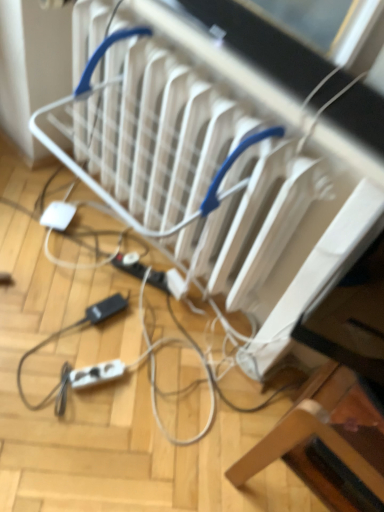
Where is `white plastic extension cord at lower left, which ranks as the 1th extension cord in bottom-to-top order`? white plastic extension cord at lower left, which ranks as the 1th extension cord in bottom-to-top order is located at coordinates (96, 374).

Image resolution: width=384 pixels, height=512 pixels. Identify the location of white plastic extension cord at lower left, which is counted as the 2th extension cord, starting from the top. (96, 374).

Between white plastic extension cord at lower left, which ranks as the 1th extension cord in bottom-to-top order, and white plastic extension cord at lower center, arranged as the 2th extension cord when viewed from the front, which one has smaller size?

With smaller size is white plastic extension cord at lower left, which ranks as the 1th extension cord in bottom-to-top order.

Looking at this image, can you confirm if white plastic extension cord at lower left, placed as the 1th extension cord when sorted from front to back, is thinner than white plastic extension cord at lower center, the 1th extension cord when ordered from top to bottom?

No.

Would you say white plastic extension cord at lower left, the second extension cord when ordered from back to front, is a long distance from white plastic extension cord at lower center, the 1th extension cord when ordered from top to bottom?

That's not correct — white plastic extension cord at lower left, the second extension cord when ordered from back to front, is a little close to white plastic extension cord at lower center, the 1th extension cord when ordered from top to bottom.

Is white plastic extension cord at lower left, which ranks as the 1th extension cord in bottom-to-top order, not within white plastic extension cord at lower center, which is counted as the second extension cord, starting from the bottom?

Yes, white plastic extension cord at lower left, which ranks as the 1th extension cord in bottom-to-top order, is located beyond the bounds of white plastic extension cord at lower center, which is counted as the second extension cord, starting from the bottom.

In the scene shown: Are white plastic extension cord at lower left, which ranks as the 1th extension cord in bottom-to-top order, and white plastic radiator at center beside each other?

No.

Is white plastic radiator at center at the back of white plastic extension cord at lower left, which ranks as the 1th extension cord in bottom-to-top order?

No, white plastic radiator at center is not at the back of white plastic extension cord at lower left, which ranks as the 1th extension cord in bottom-to-top order.

Which is in front, point (85, 373) or point (300, 232)?

The point (300, 232) is in front.

Can you confirm if white plastic extension cord at lower left, placed as the 1th extension cord when sorted from front to back, is thinner than wooden chair at lower right?

Yes.

From the image's perspective, relative to wooden chair at lower right, is white plastic extension cord at lower left, which is counted as the 2th extension cord, starting from the top, above or below?

From the image's perspective, white plastic extension cord at lower left, which is counted as the 2th extension cord, starting from the top, appears above wooden chair at lower right.

Does point (316, 390) come in front of point (140, 264)?

Yes.

Looking at this image, from a real-world perspective, is wooden chair at lower right positioned above or below white plastic extension cord at lower center, which is counted as the second extension cord, starting from the bottom?

wooden chair at lower right is situated higher than white plastic extension cord at lower center, which is counted as the second extension cord, starting from the bottom, in the real world.

Is wooden chair at lower right taller or shorter than white plastic extension cord at lower center, the first extension cord in the back-to-front sequence?

Clearly, wooden chair at lower right is taller compared to white plastic extension cord at lower center, the first extension cord in the back-to-front sequence.

Which object is wider, white plastic extension cord at lower center, the first extension cord in the back-to-front sequence, or white plastic radiator at center?

white plastic radiator at center.

Who is bigger, white plastic extension cord at lower center, the 1th extension cord when ordered from top to bottom, or white plastic radiator at center?

Bigger between the two is white plastic radiator at center.

How distant is white plastic extension cord at lower center, the first extension cord in the back-to-front sequence, from white plastic radiator at center?

white plastic extension cord at lower center, the first extension cord in the back-to-front sequence, and white plastic radiator at center are 20.42 inches apart.

Which object is further away from the camera taking this photo, white plastic extension cord at lower center, the first extension cord in the back-to-front sequence, or white plastic radiator at center?

Positioned behind is white plastic extension cord at lower center, the first extension cord in the back-to-front sequence.

Looking at the image, does white plastic radiator at center seem bigger or smaller compared to wooden chair at lower right?

Considering their sizes, white plastic radiator at center takes up more space than wooden chair at lower right.

Find the location of a particular element. The image size is (384, 512). furniture in front of the white plastic radiator at center is located at coordinates (326, 442).

Is point (343, 336) closer to camera compared to point (362, 399)?

Yes, point (343, 336) is closer to viewer.

From a real-world perspective, which is physically below, white plastic radiator at center or white plastic extension cord at lower center, the first extension cord in the back-to-front sequence?

In real-world perspective, white plastic extension cord at lower center, the first extension cord in the back-to-front sequence, is lower.

How many degrees apart are the facing directions of white plastic radiator at center and white plastic extension cord at lower center, arranged as the 2th extension cord when viewed from the front?

25.8 degrees.

From the image's perspective, would you say white plastic radiator at center is shown under white plastic extension cord at lower center, the 1th extension cord when ordered from top to bottom?

Actually, white plastic radiator at center appears above white plastic extension cord at lower center, the 1th extension cord when ordered from top to bottom, in the image.

Is white plastic radiator at center further to the viewer compared to white plastic extension cord at lower center, arranged as the 2th extension cord when viewed from the front?

No, white plastic radiator at center is closer to the viewer.

This screenshot has width=384, height=512. I want to click on extension cord above the white plastic extension cord at lower left, which ranks as the 1th extension cord in bottom-to-top order (from the image's perspective), so click(x=130, y=266).

The width and height of the screenshot is (384, 512). Find the location of `the 2nd extension cord below the white plastic radiator at center (from the image's perspective)`. the 2nd extension cord below the white plastic radiator at center (from the image's perspective) is located at coordinates (96, 374).

Estimate the real-world distances between objects in this image. Which object is further from white plastic extension cord at lower left, the second extension cord when ordered from back to front, white plastic radiator at center or wooden chair at lower right?

The object further to white plastic extension cord at lower left, the second extension cord when ordered from back to front, is white plastic radiator at center.

From the image, which object appears to be farther from white plastic extension cord at lower left, which ranks as the 1th extension cord in bottom-to-top order, white plastic extension cord at lower center, which is counted as the second extension cord, starting from the bottom, or wooden chair at lower right?

The object further to white plastic extension cord at lower left, which ranks as the 1th extension cord in bottom-to-top order, is wooden chair at lower right.

Considering their positions, is white plastic extension cord at lower center, the first extension cord in the back-to-front sequence, positioned closer to white plastic radiator at center than wooden chair at lower right?

wooden chair at lower right is positioned closer to the anchor white plastic radiator at center.

From the image, which object appears to be nearer to white plastic radiator at center, white plastic extension cord at lower center, arranged as the 2th extension cord when viewed from the front, or white plastic extension cord at lower left, which ranks as the 1th extension cord in bottom-to-top order?

Among the two, white plastic extension cord at lower center, arranged as the 2th extension cord when viewed from the front, is located nearer to white plastic radiator at center.

Which object lies further to the anchor point white plastic radiator at center, wooden chair at lower right or white plastic extension cord at lower center, arranged as the 2th extension cord when viewed from the front?

white plastic extension cord at lower center, arranged as the 2th extension cord when viewed from the front, is positioned further to the anchor white plastic radiator at center.

From the image, which object appears to be nearer to wooden chair at lower right, white plastic extension cord at lower left, which ranks as the 1th extension cord in bottom-to-top order, or white plastic extension cord at lower center, the first extension cord in the back-to-front sequence?

Based on the image, white plastic extension cord at lower left, which ranks as the 1th extension cord in bottom-to-top order, appears to be nearer to wooden chair at lower right.

From the image, which object appears to be farther from white plastic extension cord at lower center, arranged as the 2th extension cord when viewed from the front, wooden chair at lower right or white plastic radiator at center?

Based on the image, wooden chair at lower right appears to be further to white plastic extension cord at lower center, arranged as the 2th extension cord when viewed from the front.

Which object lies further to the anchor point wooden chair at lower right, white plastic extension cord at lower center, arranged as the 2th extension cord when viewed from the front, or white plastic extension cord at lower left, which ranks as the 1th extension cord in bottom-to-top order?

Among the two, white plastic extension cord at lower center, arranged as the 2th extension cord when viewed from the front, is located further to wooden chair at lower right.

Where is `radiator between wooden chair at lower right and white plastic extension cord at lower center, which is counted as the second extension cord, starting from the bottom, from front to back`? Image resolution: width=384 pixels, height=512 pixels. radiator between wooden chair at lower right and white plastic extension cord at lower center, which is counted as the second extension cord, starting from the bottom, from front to back is located at coordinates (244, 175).

Find the location of a particular element. This screenshot has width=384, height=512. extension cord between white plastic radiator at center and white plastic extension cord at lower center, which is counted as the second extension cord, starting from the bottom, in the front-back direction is located at coordinates (96, 374).

Where is `extension cord positioned between wooden chair at lower right and white plastic extension cord at lower center, the 1th extension cord when ordered from top to bottom, from near to far`? extension cord positioned between wooden chair at lower right and white plastic extension cord at lower center, the 1th extension cord when ordered from top to bottom, from near to far is located at coordinates (96, 374).